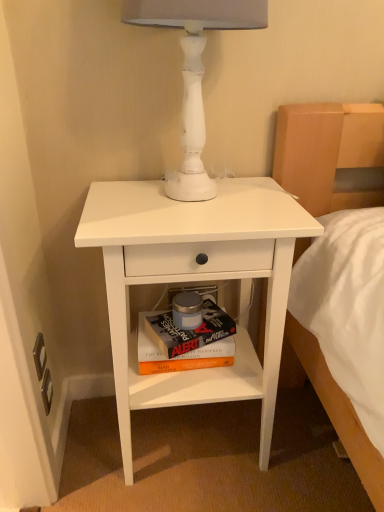
Question: Is white matte nightstand at center wider or thinner than hardcover book at center?

Choices:
 (A) thin
 (B) wide

Answer: (B)

Question: In terms of height, does white matte nightstand at center look taller or shorter compared to hardcover book at center?

Choices:
 (A) tall
 (B) short

Answer: (A)

Question: Considering the real-world distances, which object is farthest from the hardcover book at center?

Choices:
 (A) white matte table lamp at upper center
 (B) white matte nightstand at center

Answer: (A)

Question: Considering the real-world distances, which object is farthest from the white matte table lamp at upper center?

Choices:
 (A) hardcover book at center
 (B) white matte nightstand at center

Answer: (A)